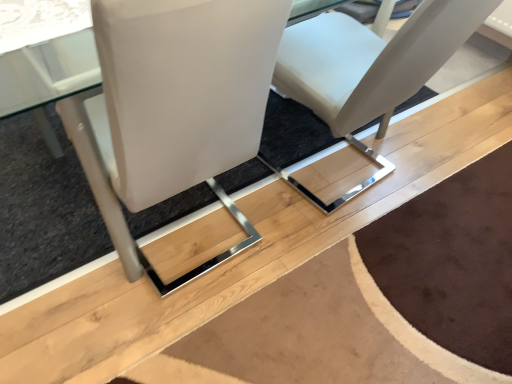
Question: Which direction should I rotate to look at white leather chair at center, the second chair positioned from the left?

Choices:
 (A) right
 (B) left

Answer: (A)

Question: Does white leather chair at center, which is the 1th chair from left to right, lie behind white leather chair at center, the second chair positioned from the left?

Choices:
 (A) no
 (B) yes

Answer: (A)

Question: From the image's perspective, is white leather chair at center, the 2th chair in the right-to-left sequence, located above white leather chair at center, the second chair positioned from the left?

Choices:
 (A) yes
 (B) no

Answer: (B)

Question: Is white leather chair at center, the 2th chair in the right-to-left sequence, aimed at white leather chair at center, arranged as the 1th chair when viewed from the right?

Choices:
 (A) yes
 (B) no

Answer: (B)

Question: Is white leather chair at center, which is the 1th chair from left to right, shorter than white leather chair at center, the second chair positioned from the left?

Choices:
 (A) yes
 (B) no

Answer: (B)

Question: Does white leather chair at center, the 2th chair in the right-to-left sequence, have a larger size compared to white leather chair at center, the second chair positioned from the left?

Choices:
 (A) yes
 (B) no

Answer: (B)

Question: Considering the relative sizes of white leather chair at center, which is the 1th chair from left to right, and white leather chair at center, arranged as the 1th chair when viewed from the right, in the image provided, is white leather chair at center, which is the 1th chair from left to right, taller than white leather chair at center, arranged as the 1th chair when viewed from the right,?

Choices:
 (A) no
 (B) yes

Answer: (B)

Question: From a real-world perspective, is white leather chair at center, arranged as the 1th chair when viewed from the right, located higher than white leather chair at center, which is the 1th chair from left to right?

Choices:
 (A) no
 (B) yes

Answer: (A)

Question: Can you confirm if white leather chair at center, the second chair positioned from the left, is wider than white leather chair at center, the 2th chair in the right-to-left sequence?

Choices:
 (A) yes
 (B) no

Answer: (A)

Question: Does white leather chair at center, the second chair positioned from the left, have a lesser height compared to white leather chair at center, which is the 1th chair from left to right?

Choices:
 (A) yes
 (B) no

Answer: (A)

Question: Is white leather chair at center, arranged as the 1th chair when viewed from the right, to the left of white leather chair at center, the 2th chair in the right-to-left sequence, from the viewer's perspective?

Choices:
 (A) yes
 (B) no

Answer: (B)

Question: Does white leather chair at center, the second chair positioned from the left, appear on the right side of white leather chair at center, the 2th chair in the right-to-left sequence?

Choices:
 (A) no
 (B) yes

Answer: (B)

Question: Is white leather chair at center, which is the 1th chair from left to right, located within white leather chair at center, the second chair positioned from the left?

Choices:
 (A) no
 (B) yes

Answer: (A)

Question: Visually, is white leather chair at center, arranged as the 1th chair when viewed from the right, positioned to the left or to the right of white leather chair at center, which is the 1th chair from left to right?

Choices:
 (A) left
 (B) right

Answer: (B)